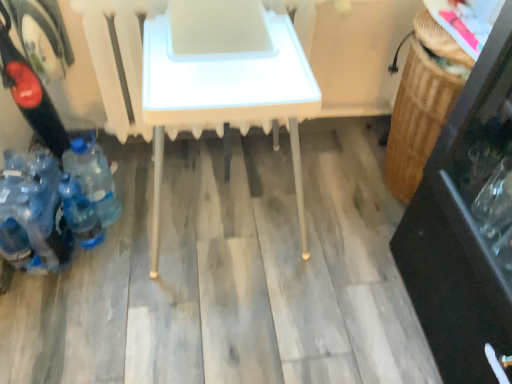
Where is `space that is in front of blue plastic bottle at lower left, the 3th bottle positioned from the left`? space that is in front of blue plastic bottle at lower left, the 3th bottle positioned from the left is located at coordinates (109, 260).